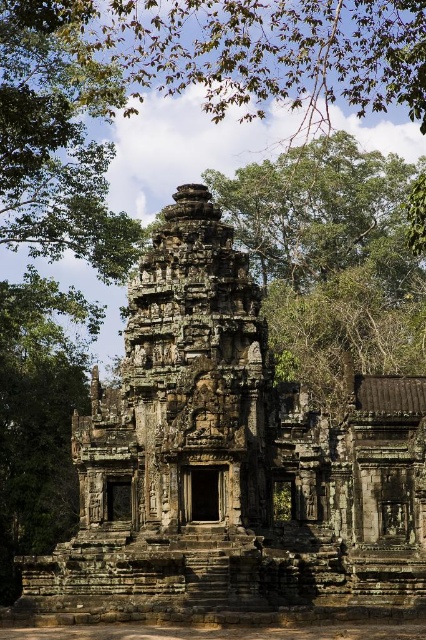
Question: Among these points, which one is farthest from the camera?

Choices:
 (A) (17, 129)
 (B) (210, 577)

Answer: (A)

Question: Among these points, which one is nearest to the camera?

Choices:
 (A) (420, 608)
 (B) (11, 10)

Answer: (A)

Question: Is gray stone temple at center further to camera compared to green leafy tree at upper left?

Choices:
 (A) yes
 (B) no

Answer: (B)

Question: Among these objects, which one is nearest to the camera?

Choices:
 (A) gray stone temple at center
 (B) green leafy tree at upper left

Answer: (A)

Question: Is gray stone temple at center behind green leafy tree at upper left?

Choices:
 (A) yes
 (B) no

Answer: (B)

Question: Is gray stone temple at center below green leafy tree at upper left?

Choices:
 (A) yes
 (B) no

Answer: (A)